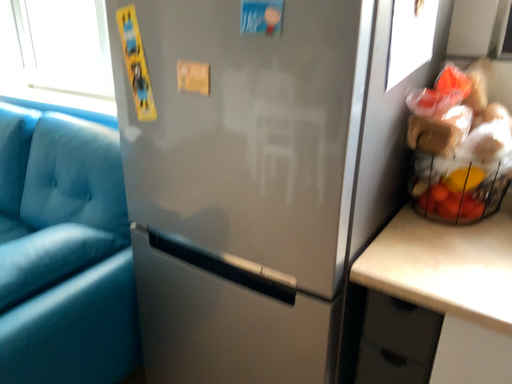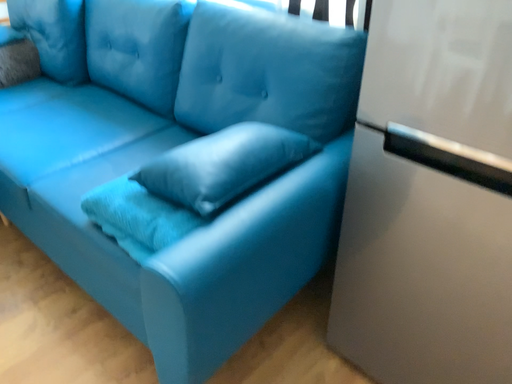
Question: Which way did the camera rotate in the video?

Choices:
 (A) rotated downward
 (B) rotated upward

Answer: (A)